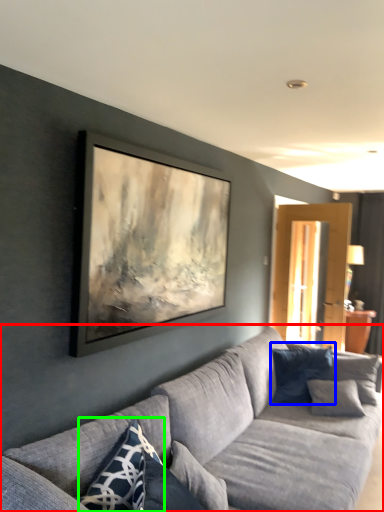
Question: Which is nearer to the studio couch (highlighted by a red box)? pillow (highlighted by a blue box) or pillow (highlighted by a green box).

Choices:
 (A) pillow
 (B) pillow

Answer: (B)